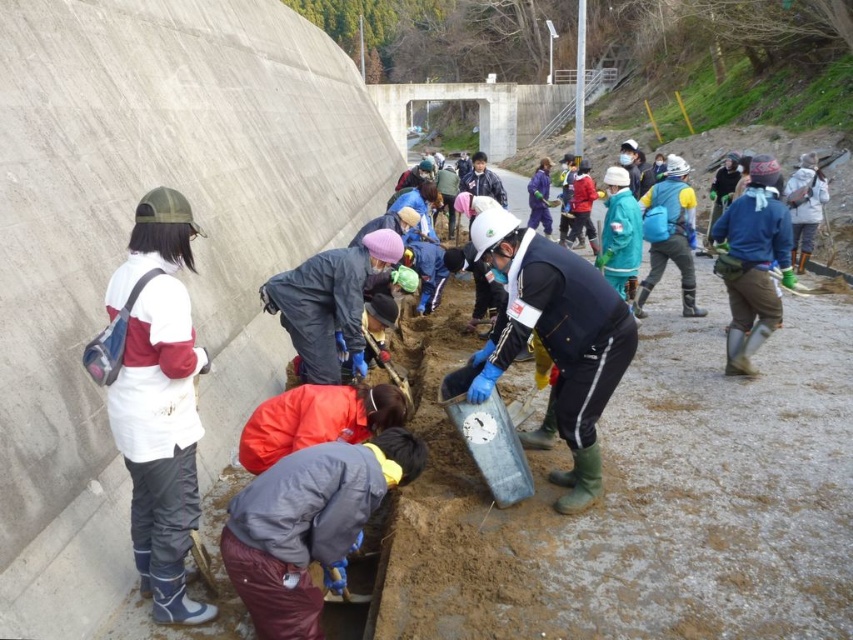
Question: Does smooth concrete at left have a smaller size compared to white hard hat at center?

Choices:
 (A) yes
 (B) no

Answer: (B)

Question: Which object appears farthest from the camera in this image?

Choices:
 (A) white hard hat at center
 (B) smooth concrete at left

Answer: (A)

Question: From the image, what is the correct spatial relationship of smooth concrete at left in relation to white hard hat at center?

Choices:
 (A) below
 (B) above

Answer: (B)

Question: Among these points, which one is nearest to the camera?

Choices:
 (A) (131, 58)
 (B) (567, 292)
 (C) (131, 465)

Answer: (C)

Question: Is white matte jacket at left wider than white hard hat at center?

Choices:
 (A) yes
 (B) no

Answer: (B)

Question: Estimate the real-world distances between objects in this image. Which object is farther from the white hard hat at center?

Choices:
 (A) smooth concrete at left
 (B) white matte jacket at left

Answer: (A)